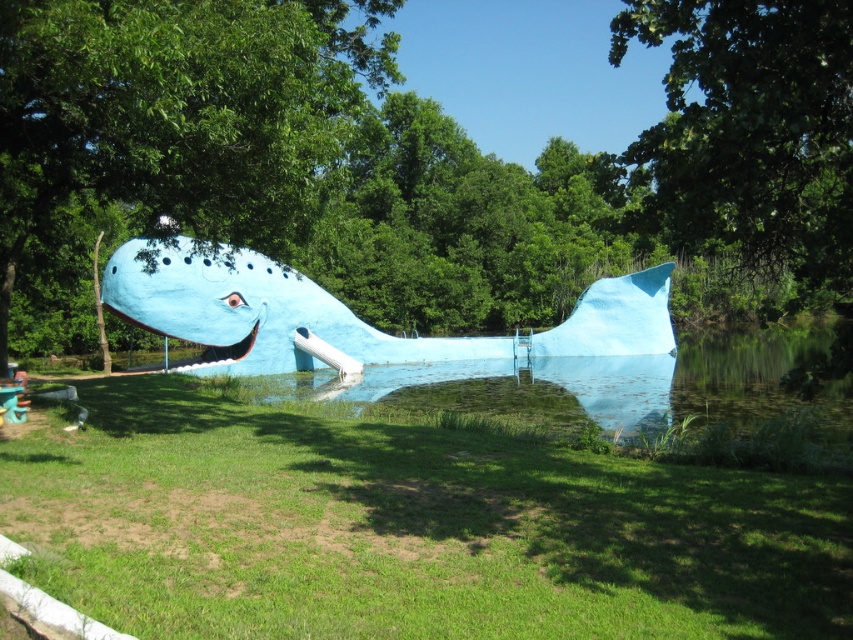
You are standing in front of the whale sculpture and want to touch both points on its body. Which point, point (788, 394) or point (165, 285), is closer to you?

Point (788, 394) is closer to the viewer than point (165, 285).